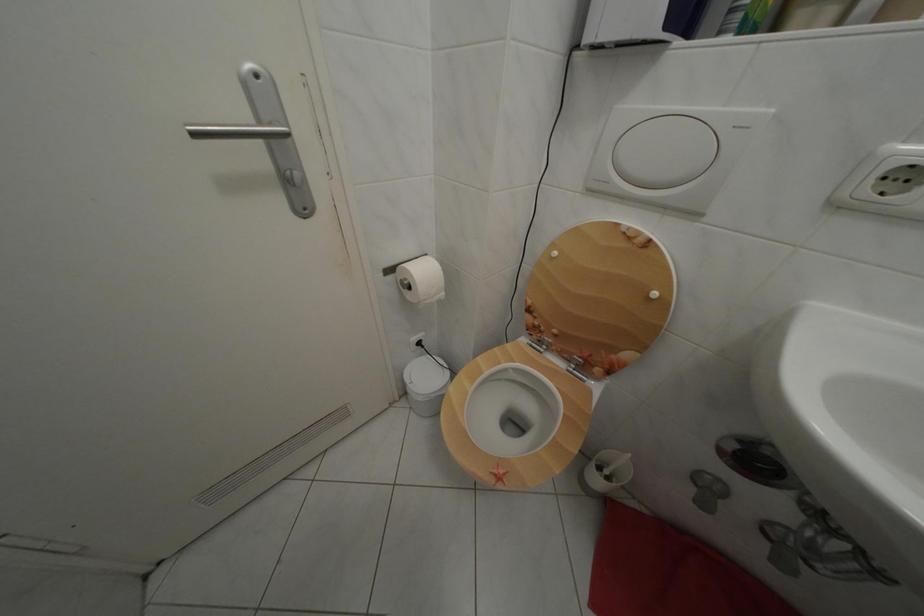
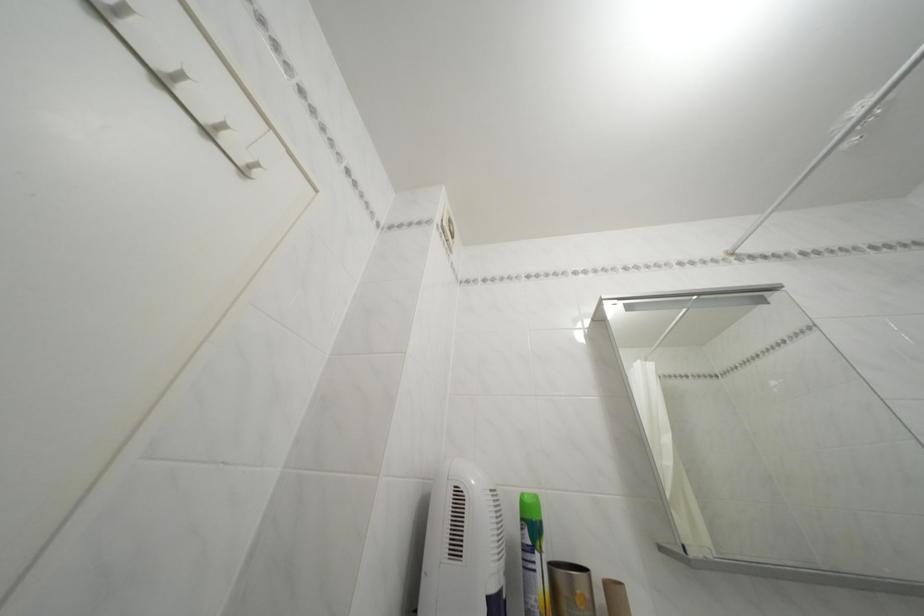
The images are taken continuously from a first-person perspective. In which direction is your viewpoint rotating?

The camera's rotation is toward right-up.